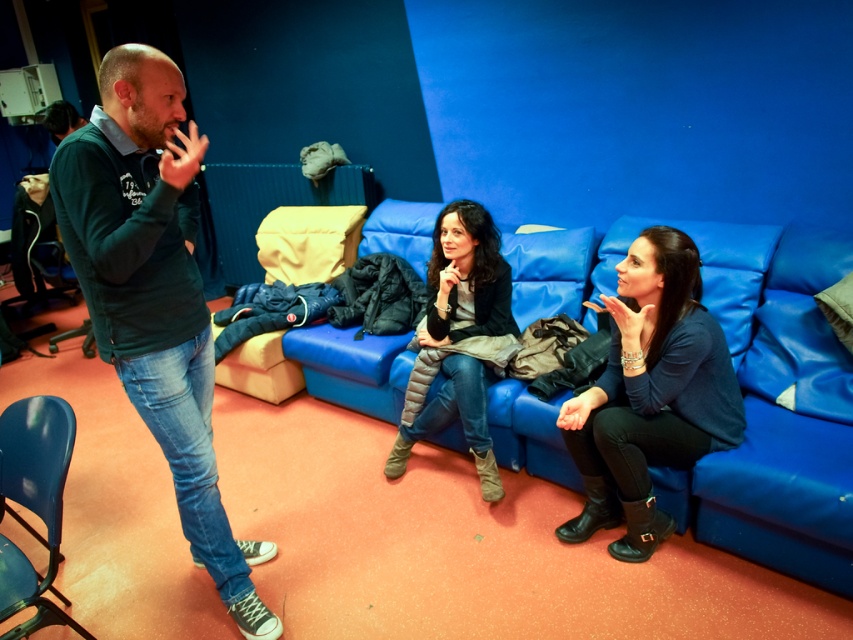
You are a fashion designer observing the scene. You notice two clothing items at center, the matte black sweater at center and the dark gray quilted jacket at center. Which clothing item is positioned to the right?

The matte black sweater at center is positioned to the right of the dark gray quilted jacket at center.

From the picture: You are standing in the room and want to sit on the blue leather couch at center. Which direction should you move to reach it?

The blue leather couch at center is located at point coordinates 0.634 on the x axis and 0.898 on the y axis. To reach it, you should move towards the center of the room where the blue leather couch at center is situated.

You are standing in the room and want to take a photo of the point at coordinates (x=161, y=417). The camera you are using has a minimum focus distance of 1.5 meters. Will the camera be able to focus on the point?

The point at coordinates (x=161, y=417) is 1.77 meters away from the camera. Since the minimum focus distance is 1.5 meters, the camera can focus on the point because it is beyond the minimum required distance.